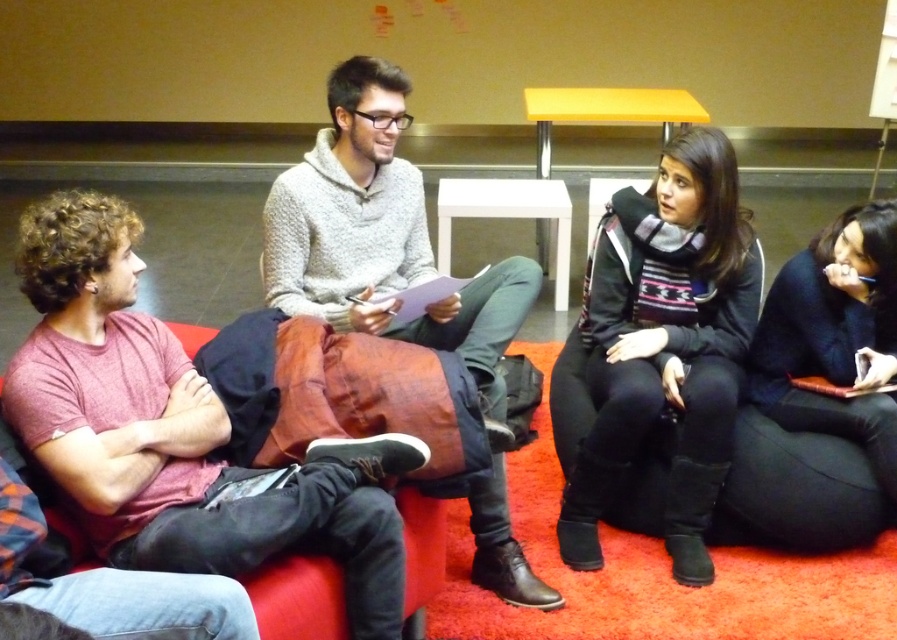
Does black fleece jacket at center have a greater width compared to gray knit sweater at center?

In fact, black fleece jacket at center might be narrower than gray knit sweater at center.

Who is more forward, (682, 486) or (341, 195)?

Point (682, 486)

Is point (717, 323) closer to viewer compared to point (499, 561)?

No, it is not.

The image size is (897, 640). Identify the location of black fleece jacket at center. (663, 346).

Between point (726, 288) and point (572, 432), which one is positioned behind?

Point (572, 432)

Between point (608, 262) and point (812, 522), which one is positioned in front?

Point (812, 522) is in front.

Where is `black fleece jacket at center`? The image size is (897, 640). black fleece jacket at center is located at coordinates (663, 346).

Between gray knit sweater at center and black woolen sweater at right, which one appears on the left side from the viewer's perspective?

Positioned to the left is gray knit sweater at center.

Is gray knit sweater at center to the left of black woolen sweater at right from the viewer's perspective?

Correct, you'll find gray knit sweater at center to the left of black woolen sweater at right.

Does point (289, 314) lie behind point (816, 272)?

No, (289, 314) is in front of (816, 272).

At what (x,y) coordinates should I click in order to perform the action: click on gray knit sweater at center. Please return your answer as a coordinate pair (x, y). Looking at the image, I should click on (381, 237).